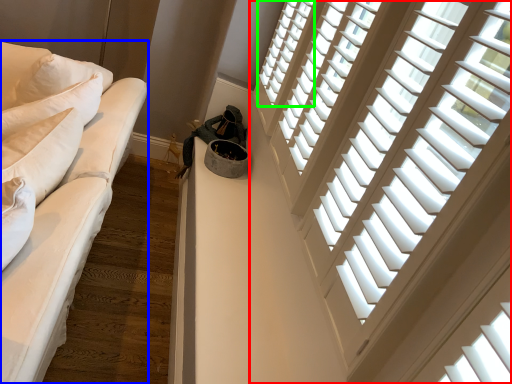
Question: Which object is the closest to the window (highlighted by a red box)? Choose among these: studio couch (highlighted by a blue box) or window (highlighted by a green box).

Choices:
 (A) studio couch
 (B) window

Answer: (A)